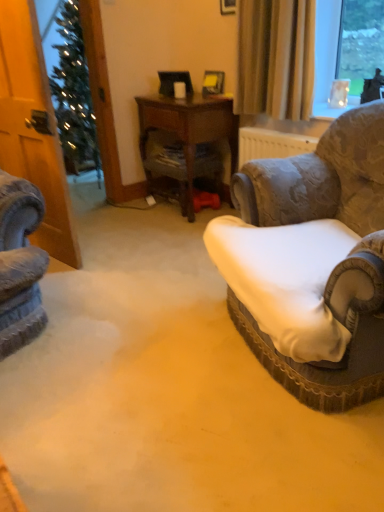
Question: Should I look upward or downward to see wooden desk at center?

Choices:
 (A) up
 (B) down

Answer: (A)

Question: Is velvet-patterned armchair at right to the right of white fabric cushion at right from the viewer's perspective?

Choices:
 (A) no
 (B) yes

Answer: (B)

Question: Is velvet-patterned armchair at right beside white fabric cushion at right?

Choices:
 (A) yes
 (B) no

Answer: (B)

Question: Does velvet-patterned armchair at right appear on the left side of white fabric cushion at right?

Choices:
 (A) no
 (B) yes

Answer: (A)

Question: Is white fabric cushion at right at the back of velvet-patterned armchair at right?

Choices:
 (A) yes
 (B) no

Answer: (B)

Question: Can you confirm if velvet-patterned armchair at right is thinner than white fabric cushion at right?

Choices:
 (A) no
 (B) yes

Answer: (B)

Question: Is the depth of velvet-patterned armchair at right greater than that of white fabric cushion at right?

Choices:
 (A) no
 (B) yes

Answer: (B)

Question: Is beige fabric curtain at upper right next to white fabric cushion at right and touching it?

Choices:
 (A) no
 (B) yes

Answer: (A)

Question: Is beige fabric curtain at upper right far away from white fabric cushion at right?

Choices:
 (A) yes
 (B) no

Answer: (A)

Question: Does beige fabric curtain at upper right appear on the right side of white fabric cushion at right?

Choices:
 (A) no
 (B) yes

Answer: (B)

Question: Can you confirm if beige fabric curtain at upper right is taller than white fabric cushion at right?

Choices:
 (A) no
 (B) yes

Answer: (B)

Question: From the image's perspective, is beige fabric curtain at upper right under white fabric cushion at right?

Choices:
 (A) no
 (B) yes

Answer: (A)

Question: From a real-world perspective, does beige fabric curtain at upper right stand above white fabric cushion at right?

Choices:
 (A) no
 (B) yes

Answer: (B)

Question: From the image's perspective, is white fabric cushion at right on wooden desk at center?

Choices:
 (A) no
 (B) yes

Answer: (A)